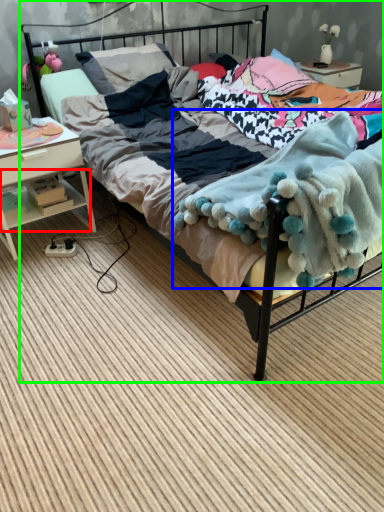
Question: Which is farther away from shelf (highlighted by a red box)? blanket (highlighted by a blue box) or bed (highlighted by a green box)?

Choices:
 (A) blanket
 (B) bed

Answer: (A)